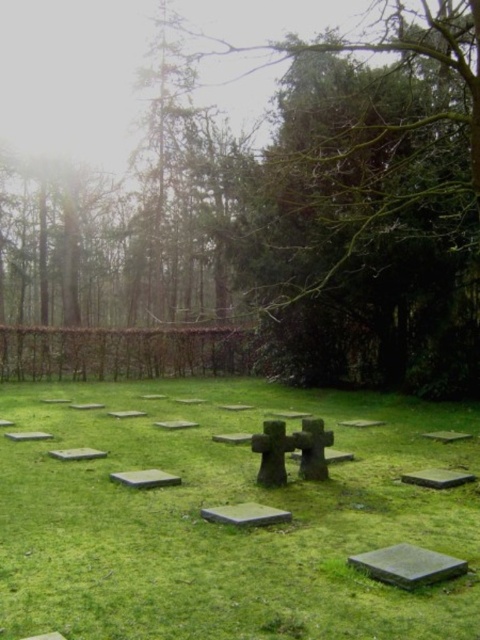
You are standing at the entrance of the cemetery and want to locate two specific points marked on a map. The first point is at coordinates point (399, 582) and the second is at point (244, 440). Which point is closer to your current position?

Point (399, 582) is closer to the camera than point (244, 440), so the first point is closer to your current position.

You are standing at the entrance of the cemetery and see the smooth gray stone at lower right and the black stone gravestone at lower right. Which one is positioned more to the left side from your perspective?

The smooth gray stone at lower right is positioned more to the left side from your perspective than the black stone gravestone at lower right.